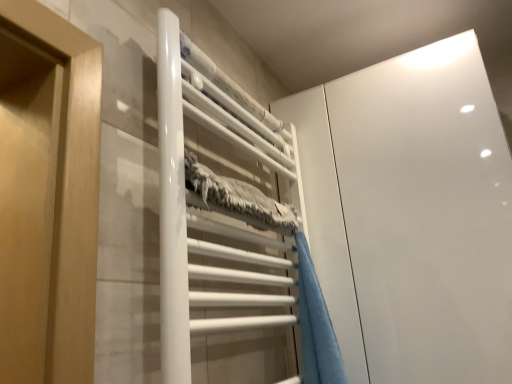
Question: From a real-world perspective, is white glossy towel rack at center over blue plush towel at center?

Choices:
 (A) no
 (B) yes

Answer: (B)

Question: Is white glossy towel rack at center next to blue plush towel at center?

Choices:
 (A) yes
 (B) no

Answer: (B)

Question: Is white glossy towel rack at center wider than blue plush towel at center?

Choices:
 (A) no
 (B) yes

Answer: (A)

Question: Is white glossy towel rack at center to the left of blue plush towel at center from the viewer's perspective?

Choices:
 (A) yes
 (B) no

Answer: (A)

Question: From the image's perspective, would you say white glossy towel rack at center is shown under blue plush towel at center?

Choices:
 (A) no
 (B) yes

Answer: (A)

Question: Relative to white glossy cabinet at upper right, is white glossy towel rack at center in front or behind?

Choices:
 (A) front
 (B) behind

Answer: (A)

Question: Looking at their shapes, would you say white glossy towel rack at center is wider or thinner than white glossy cabinet at upper right?

Choices:
 (A) thin
 (B) wide

Answer: (A)

Question: Is white glossy towel rack at center taller or shorter than white glossy cabinet at upper right?

Choices:
 (A) short
 (B) tall

Answer: (A)

Question: From a real-world perspective, is white glossy towel rack at center physically located above or below white glossy cabinet at upper right?

Choices:
 (A) above
 (B) below

Answer: (B)

Question: From a real-world perspective, relative to white glossy towel rack at center, is blue plush towel at center vertically above or below?

Choices:
 (A) above
 (B) below

Answer: (B)

Question: Looking at their shapes, would you say blue plush towel at center is wider or thinner than white glossy towel rack at center?

Choices:
 (A) wide
 (B) thin

Answer: (A)

Question: From their relative heights in the image, would you say blue plush towel at center is taller or shorter than white glossy towel rack at center?

Choices:
 (A) tall
 (B) short

Answer: (B)

Question: Is blue plush towel at center bigger or smaller than white glossy towel rack at center?

Choices:
 (A) small
 (B) big

Answer: (A)

Question: Considering the positions of white glossy cabinet at upper right and white glossy towel rack at center in the image, is white glossy cabinet at upper right wider or thinner than white glossy towel rack at center?

Choices:
 (A) thin
 (B) wide

Answer: (B)

Question: From a real-world perspective, is white glossy cabinet at upper right positioned above or below white glossy towel rack at center?

Choices:
 (A) above
 (B) below

Answer: (A)